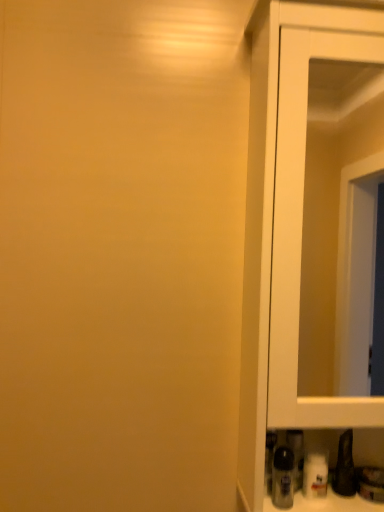
Question: Is translucent plastic bottle at lower right to the left of white glossy cupboard at right from the viewer's perspective?

Choices:
 (A) no
 (B) yes

Answer: (B)

Question: Considering the relative sizes of translucent plastic bottle at lower right and white glossy cupboard at right in the image provided, is translucent plastic bottle at lower right wider than white glossy cupboard at right?

Choices:
 (A) yes
 (B) no

Answer: (B)

Question: Does translucent plastic bottle at lower right come behind white glossy cupboard at right?

Choices:
 (A) no
 (B) yes

Answer: (B)

Question: Is translucent plastic bottle at lower right located outside white glossy cupboard at right?

Choices:
 (A) no
 (B) yes

Answer: (A)

Question: From a real-world perspective, is translucent plastic bottle at lower right beneath white glossy cupboard at right?

Choices:
 (A) no
 (B) yes

Answer: (B)

Question: Is white glossy cupboard at right inside translucent plastic bottle at lower right?

Choices:
 (A) yes
 (B) no

Answer: (B)

Question: Is white glossy cupboard at right shorter than translucent plastic bottle at lower right?

Choices:
 (A) no
 (B) yes

Answer: (A)

Question: Is white glossy cupboard at right bigger than translucent plastic bottle at lower right?

Choices:
 (A) no
 (B) yes

Answer: (B)

Question: Could you tell me if white glossy cupboard at right is facing translucent plastic bottle at lower right?

Choices:
 (A) no
 (B) yes

Answer: (B)

Question: Is white glossy cupboard at right wider than translucent plastic bottle at lower right?

Choices:
 (A) yes
 (B) no

Answer: (A)

Question: From the image's perspective, is white glossy cupboard at right located above translucent plastic bottle at lower right?

Choices:
 (A) no
 (B) yes

Answer: (B)

Question: From a real-world perspective, is white glossy cupboard at right on top of translucent plastic bottle at lower right?

Choices:
 (A) no
 (B) yes

Answer: (B)

Question: From a real-world perspective, is translucent plastic bottle at lower right physically located above or below white glossy cupboard at right?

Choices:
 (A) below
 (B) above

Answer: (A)